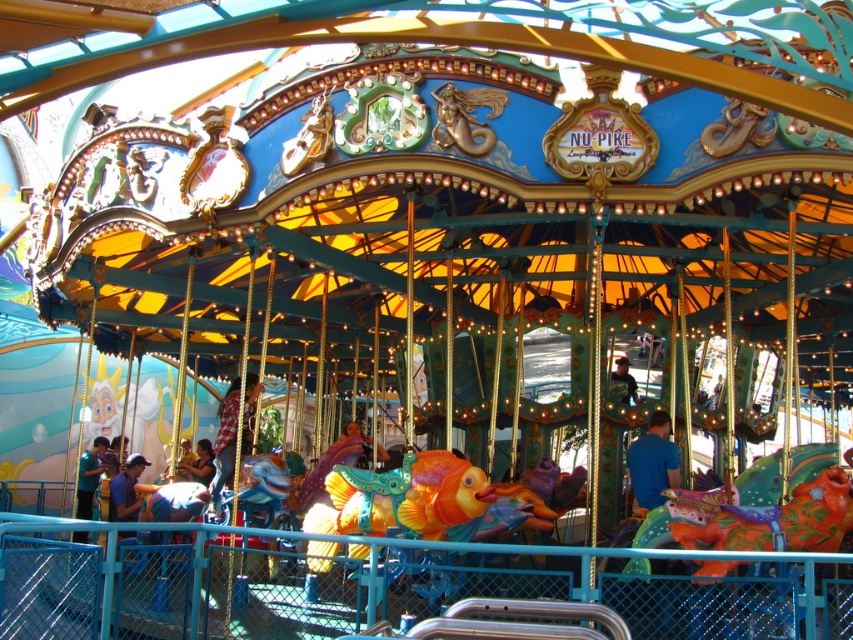
Question: Which object is positioned farthest from the blue matte shirt at center?

Choices:
 (A) blue fabric shirt at lower left
 (B) matte blue shirt at lower center
 (C) shiny orange horse at center
 (D) matte purple shirt at center

Answer: (A)

Question: Among these points, which one is nearest to the camera?

Choices:
 (A) (666, 454)
 (B) (96, 483)
 (C) (798, 492)
 (D) (207, 440)

Answer: (C)

Question: From the image, what is the correct spatial relationship of blue fabric shirt at lower left in relation to matte black jacket at center?

Choices:
 (A) left
 (B) right

Answer: (A)

Question: Which point is farther to the camera?

Choices:
 (A) matte purple shirt at center
 (B) blue matte shirt at center

Answer: (A)

Question: Is blue fabric shirt at lower left wider than matte purple shirt at center?

Choices:
 (A) no
 (B) yes

Answer: (B)

Question: Is matte black jacket at center smaller than matte purple shirt at center?

Choices:
 (A) no
 (B) yes

Answer: (B)